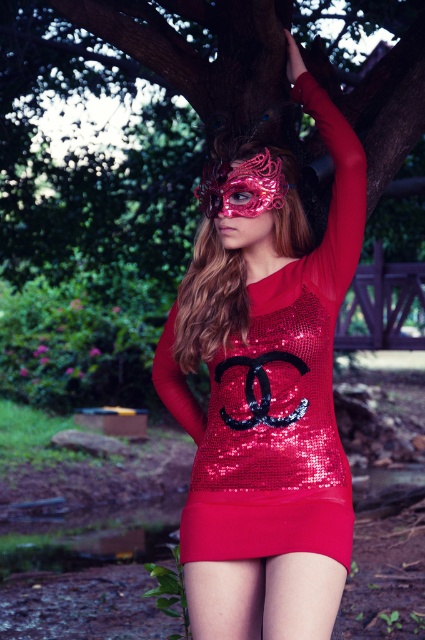
This screenshot has height=640, width=425. In order to click on shiny sequined dress at center in this screenshot , I will do `click(266, 388)`.

Can you confirm if shiny sequined dress at center is positioned to the left of matte sequined skirt at lower center?

Indeed, shiny sequined dress at center is positioned on the left side of matte sequined skirt at lower center.

You are a GUI agent. You are given a task and a screenshot of the screen. Output one action in this format:
    pyautogui.click(x=<x>, y=<y>)
    Task: Click on the shiny sequined dress at center
    
    Given the screenshot: What is the action you would take?
    pyautogui.click(x=266, y=388)

Image resolution: width=425 pixels, height=640 pixels. Identify the location of shiny sequined dress at center. (266, 388).